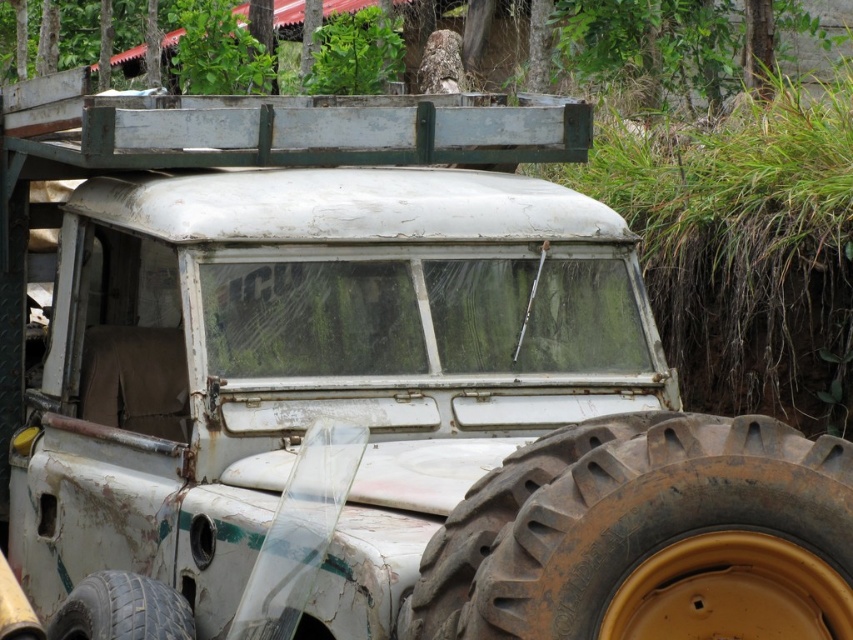
Is the position of rusty rubber tire at lower right more distant than that of dark brown rubber tire at lower left?

That is False.

Does rusty rubber tire at lower right appear on the right side of dark brown rubber tire at lower left?

Indeed, rusty rubber tire at lower right is positioned on the right side of dark brown rubber tire at lower left.

Is point (463, 545) closer to camera compared to point (181, 614)?

Yes, it is in front of point (181, 614).

Locate an element on the screen. The image size is (853, 640). rusty rubber tire at lower right is located at coordinates (648, 536).